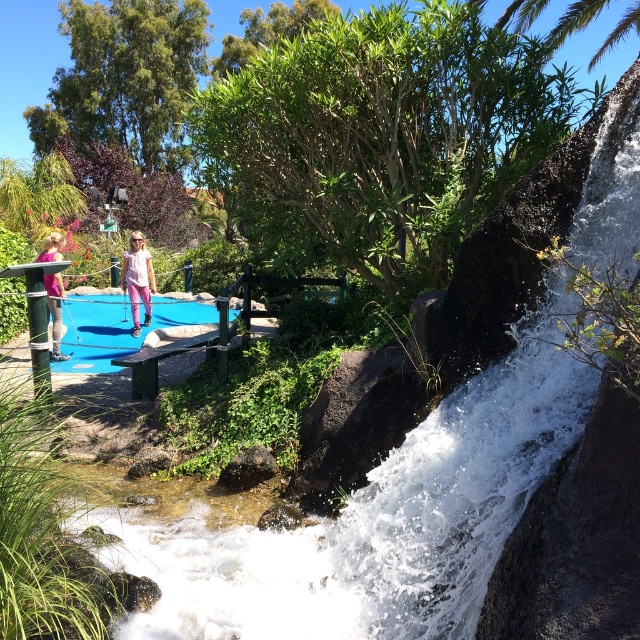
Based on the photo, does white frothy water at upper right have a greater height compared to pink fabric pants at left?

Yes.

Who is lower down, white frothy water at upper right or pink fabric pants at left?

white frothy water at upper right is lower down.

Who is more distant from viewer, (586, 492) or (58, 336)?

The point (58, 336) is behind.

Image resolution: width=640 pixels, height=640 pixels. In order to click on white frothy water at upper right in this screenshot , I will do pos(458,483).

Between pink matte pants at left and pink fabric pants at left, which one appears on the left side from the viewer's perspective?

Positioned to the left is pink fabric pants at left.

Measure the distance between pink matte pants at left and camera.

pink matte pants at left and camera are 10.93 meters apart from each other.

Which is in front, point (132, 324) or point (52, 257)?

Positioned in front is point (52, 257).

You are a GUI agent. You are given a task and a screenshot of the screen. Output one action in this format:
    pyautogui.click(x=<x>, y=<y>)
    Task: Click on the pink matte pants at left
    The width and height of the screenshot is (640, 640).
    Given the screenshot: What is the action you would take?
    pyautogui.click(x=138, y=278)

Consider the image. Is white frothy water at upper right below pink matte pants at left?

Indeed, white frothy water at upper right is positioned under pink matte pants at left.

Between white frothy water at upper right and pink matte pants at left, which one has more height?

Standing taller between the two is white frothy water at upper right.

Between point (509, 621) and point (132, 292), which one is positioned behind?

Positioned behind is point (132, 292).

This screenshot has height=640, width=640. Find the location of `white frothy water at upper right`. white frothy water at upper right is located at coordinates pyautogui.click(x=458, y=483).